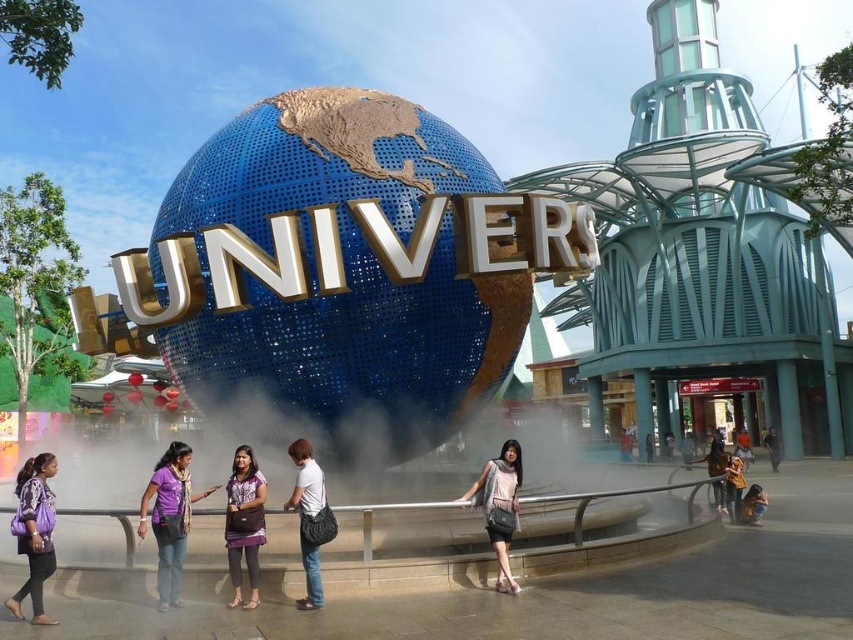
You are a photographer at Universal Studios and need to capture a shot of the purple fabric scarf at lower center and the white matte bag at center. From the perspective of the camera, which object is positioned to the left?

The purple fabric scarf at lower center is to the left of the white matte bag at center, so from the camera perspective, the purple fabric scarf at lower center is on the left side.

You are standing in front of the Universal Studios globe and want to take a photo. There are two points marked on the ground where you can stand. One is at point (514, 502) and the other is at point (312, 484). Which point is closer to you?

Point (514, 502) is further to the viewer than point (312, 484), so the point at (312, 484) is closer to you.